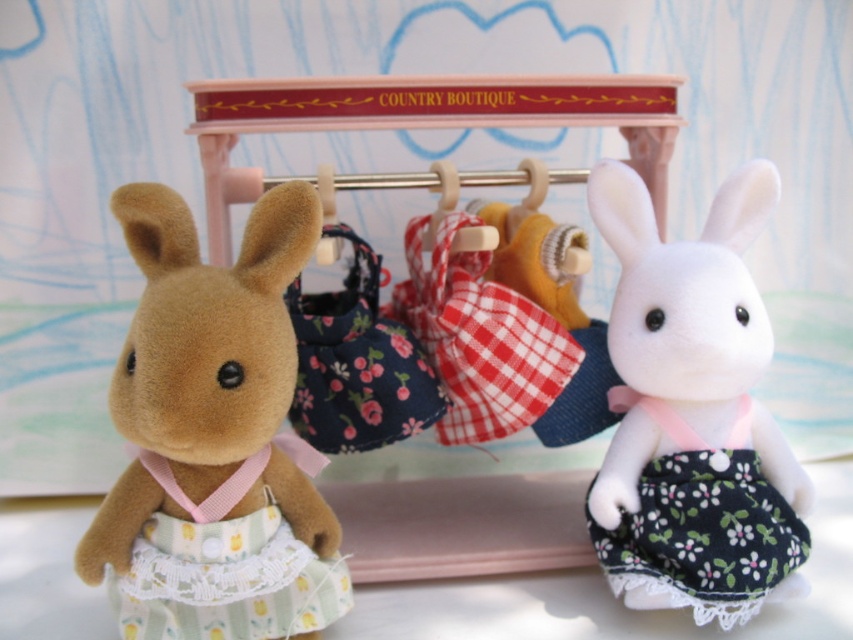
Which is behind, point (276, 518) or point (653, 344)?

The point (653, 344) is more distant.

Looking at this image, does fluffy brown plush at left have a greater width compared to white fabric dress at right?

Yes, fluffy brown plush at left is wider than white fabric dress at right.

At what (x,y) coordinates should I click in order to perform the action: click on fluffy brown plush at left. Please return your answer as a coordinate pair (x, y). The height and width of the screenshot is (640, 853). Looking at the image, I should click on (213, 436).

Can you confirm if fluffy brown plush at left is positioned to the right of black floral fabric dress at center?

No, fluffy brown plush at left is not to the right of black floral fabric dress at center.

Between point (86, 560) and point (758, 550), which one is positioned in front?

Point (86, 560) is in front.

I want to click on fluffy brown plush at left, so click(213, 436).

Consider the image. Can you confirm if white fabric dress at right is bigger than black floral fabric dress at center?

Yes.

Does white fabric dress at right lie in front of black floral fabric dress at center?

Yes.

Find the location of a particular element. This screenshot has width=853, height=640. white fabric dress at right is located at coordinates (693, 413).